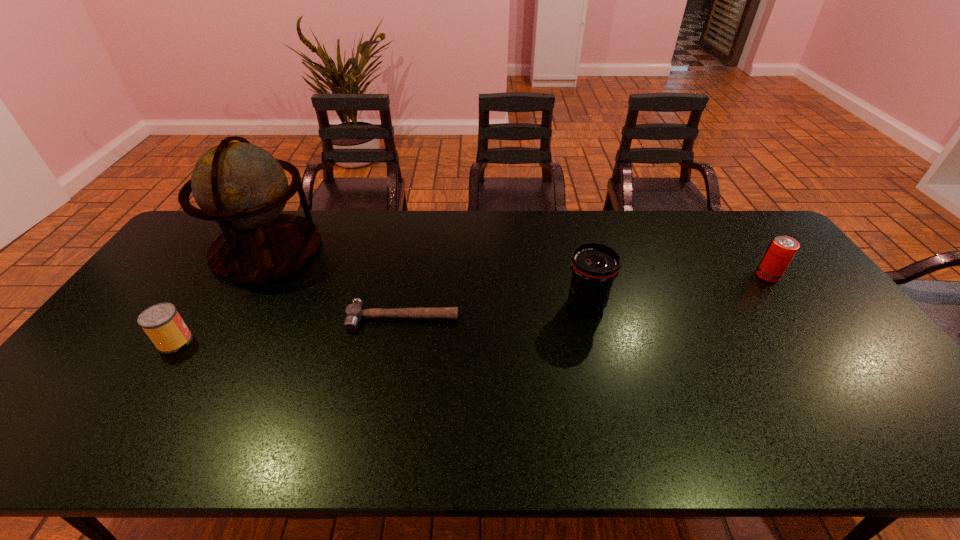
Locate an element on the screen. Image resolution: width=960 pixels, height=540 pixels. vacant area at the near edge of the desktop is located at coordinates pyautogui.click(x=647, y=442).

What are the coordinates of `free space at the left edge of the desktop` in the screenshot? It's located at (124, 347).

You are a GUI agent. You are given a task and a screenshot of the screen. Output one action in this format:
    pyautogui.click(x=<x>, y=<y>)
    Task: Click on the vacant space at the right edge of the desktop
    The width and height of the screenshot is (960, 540).
    Given the screenshot: What is the action you would take?
    coord(827,303)

I want to click on free space between the rightmost object and the globe, so click(x=517, y=262).

Locate an element on the screen. The image size is (960, 540). free space between the taller can and the tallest object is located at coordinates (517, 262).

The height and width of the screenshot is (540, 960). Find the location of `free area in between the fourth object from left to right and the shorter can`. free area in between the fourth object from left to right and the shorter can is located at coordinates (380, 323).

The height and width of the screenshot is (540, 960). Find the location of `unoccupied position between the tallest object and the nearer can`. unoccupied position between the tallest object and the nearer can is located at coordinates (221, 295).

Locate an element on the screen. This screenshot has width=960, height=540. unoccupied area between the third tallest object and the second object from right to left is located at coordinates (677, 290).

Locate an element on the screen. empty space between the second shortest object and the fourth object from left to right is located at coordinates (380, 323).

Find the location of a particular element. The height and width of the screenshot is (540, 960). free space between the fourth object from left to right and the taller can is located at coordinates (677, 290).